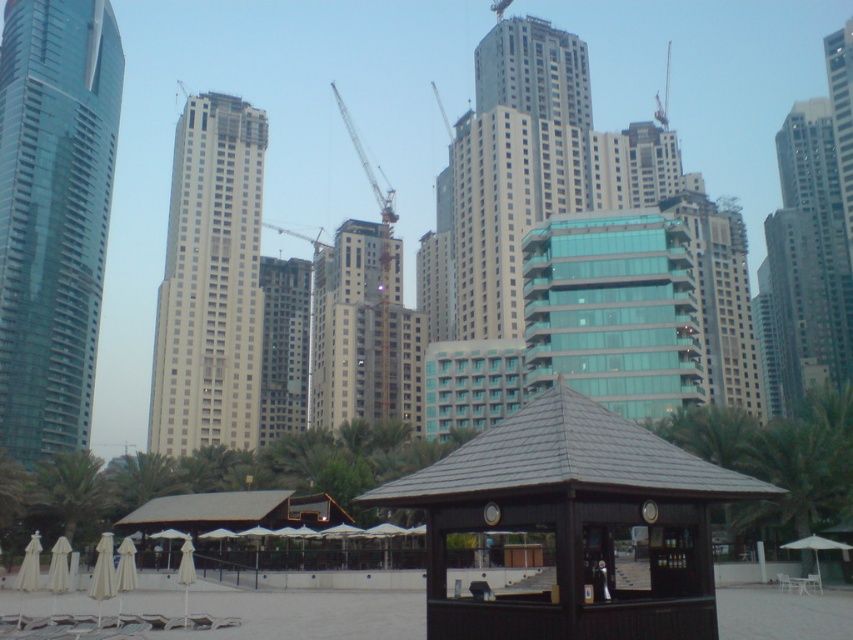
Can you confirm if glassy steel skyscraper at center is shorter than metallic construction crane at center?

Indeed, glassy steel skyscraper at center has a lesser height compared to metallic construction crane at center.

Looking at this image, which of these two, glassy steel skyscraper at center or metallic construction crane at center, stands taller?

metallic construction crane at center

Is point (454, 314) farther from camera compared to point (389, 250)?

No, it is in front of (389, 250).

Where is `glassy steel skyscraper at center`? This screenshot has height=640, width=853. glassy steel skyscraper at center is located at coordinates (515, 164).

Which is in front, point (596, 465) or point (83, 129)?

Point (596, 465) is more forward.

Can you confirm if dark brown wooden gazebo at center is shorter than shiny glass skyscraper at left?

Yes.

Where is `dark brown wooden gazebo at center`? dark brown wooden gazebo at center is located at coordinates (573, 524).

You are a GUI agent. You are given a task and a screenshot of the screen. Output one action in this format:
    pyautogui.click(x=<x>, y=<y>)
    Task: Click on the dark brown wooden gazebo at center
    Image resolution: width=853 pixels, height=640 pixels.
    Given the screenshot: What is the action you would take?
    pos(573,524)

Who is more forward, (77, 492) or (125, 500)?

Positioned in front is point (77, 492).

What do you see at coordinates (68, 490) in the screenshot?
I see `green leafy palm tree at lower left` at bounding box center [68, 490].

Does point (82, 451) come closer to viewer compared to point (183, 484)?

No, (82, 451) is behind (183, 484).

Identify the location of green leafy palm tree at lower left. (68, 490).